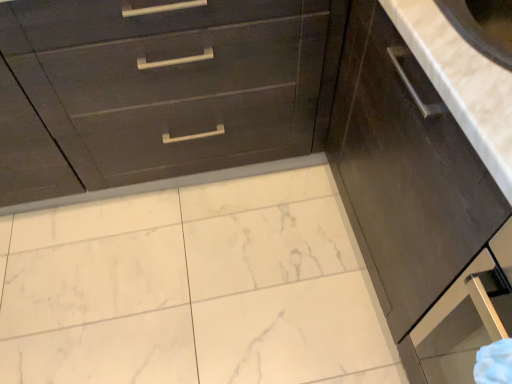
Question: Can you confirm if white marble countertop at upper right is smaller than dark wood drawer at upper left?

Choices:
 (A) no
 (B) yes

Answer: (B)

Question: Does white marble countertop at upper right have a larger size compared to dark wood drawer at upper left?

Choices:
 (A) no
 (B) yes

Answer: (A)

Question: Is white marble countertop at upper right surrounding dark wood drawer at upper left?

Choices:
 (A) no
 (B) yes

Answer: (A)

Question: Is white marble countertop at upper right outside of dark wood drawer at upper left?

Choices:
 (A) yes
 (B) no

Answer: (A)

Question: Is white marble countertop at upper right in contact with dark wood drawer at upper left?

Choices:
 (A) no
 (B) yes

Answer: (A)

Question: From the image's perspective, is white marble countertop at upper right above or below dark wood cabinet at right?

Choices:
 (A) below
 (B) above

Answer: (B)

Question: Considering their positions, is white marble countertop at upper right located in front of or behind dark wood cabinet at right?

Choices:
 (A) front
 (B) behind

Answer: (B)

Question: In terms of height, does white marble countertop at upper right look taller or shorter compared to dark wood cabinet at right?

Choices:
 (A) short
 (B) tall

Answer: (A)

Question: Based on their sizes in the image, would you say white marble countertop at upper right is bigger or smaller than dark wood cabinet at right?

Choices:
 (A) big
 (B) small

Answer: (B)

Question: Is dark wood cabinet at right taller or shorter than dark wood drawer at upper left?

Choices:
 (A) tall
 (B) short

Answer: (B)

Question: In the image, is dark wood cabinet at right on the left side or the right side of dark wood drawer at upper left?

Choices:
 (A) left
 (B) right

Answer: (B)

Question: From the image's perspective, is dark wood cabinet at right positioned above or below dark wood drawer at upper left?

Choices:
 (A) above
 (B) below

Answer: (B)

Question: Is point (410, 160) positioned closer to the camera than point (298, 28)?

Choices:
 (A) farther
 (B) closer

Answer: (B)

Question: In terms of width, does white marble countertop at upper right look wider or thinner when compared to dark wood drawer at upper left?

Choices:
 (A) wide
 (B) thin

Answer: (B)

Question: From the image's perspective, is white marble countertop at upper right positioned above or below dark wood drawer at upper left?

Choices:
 (A) above
 (B) below

Answer: (B)